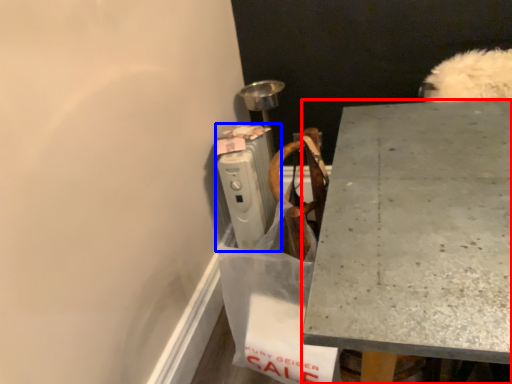
Question: Which of the following is the farthest to the observer, desk (highlighted by a red box) or radiator (highlighted by a blue box)?

Choices:
 (A) desk
 (B) radiator

Answer: (B)